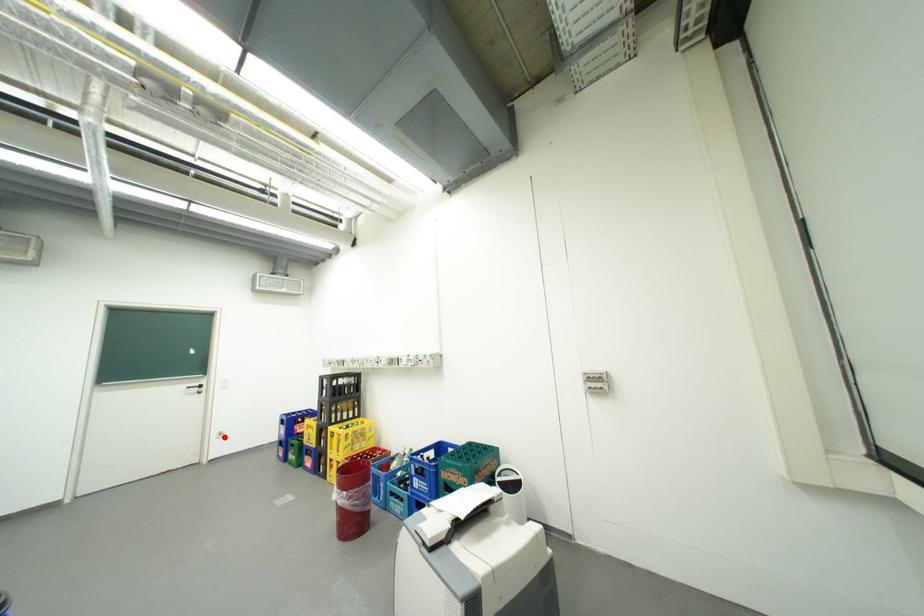
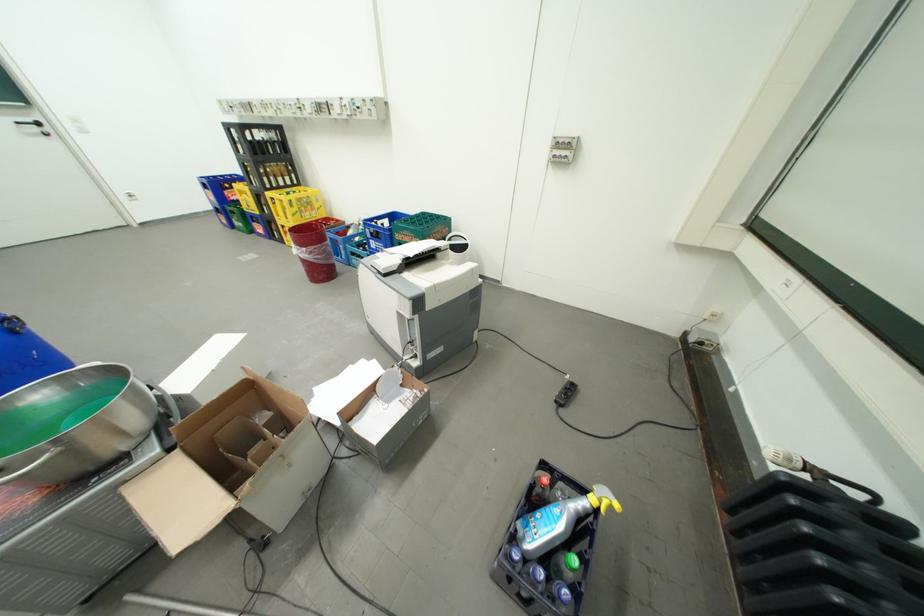
Question: A red point is marked in image1. In image2, is the corresponding 3D point closer to the camera or farther? Reply with the corresponding letter.

Choices:
 (A) The corresponding 3D point is closer.
 (B) The corresponding 3D point is farther.

Answer: (B)